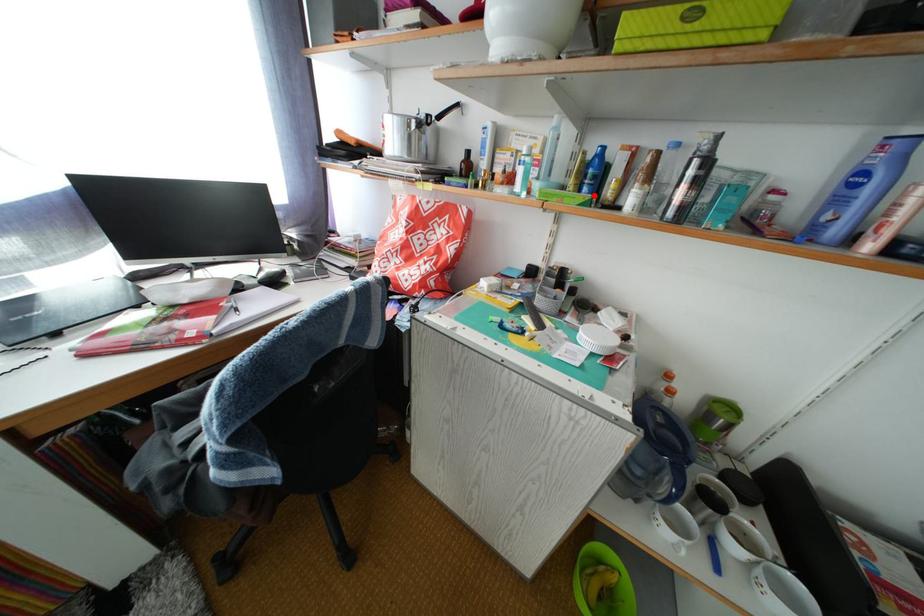
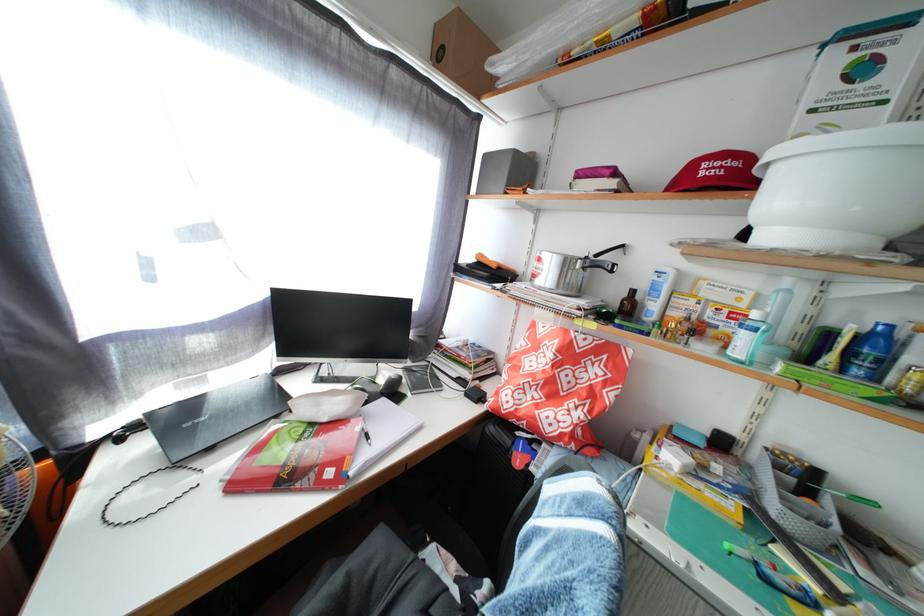
Question: A red point is marked in image1. In image2, is the corresponding 3D point closer to the camera or farther? Reply with the corresponding letter.

Choices:
 (A) The corresponding 3D point is closer.
 (B) The corresponding 3D point is farther.

Answer: (B)